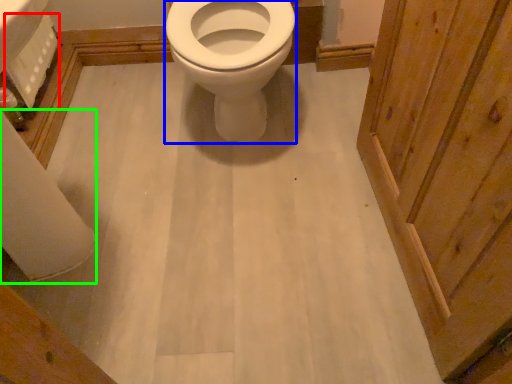
Question: Based on their relative distances, which object is nearer to toilet paper (highlighted by a red box)? Choose from bidet (highlighted by a blue box) and toilet paper (highlighted by a green box).

Choices:
 (A) bidet
 (B) toilet paper

Answer: (B)